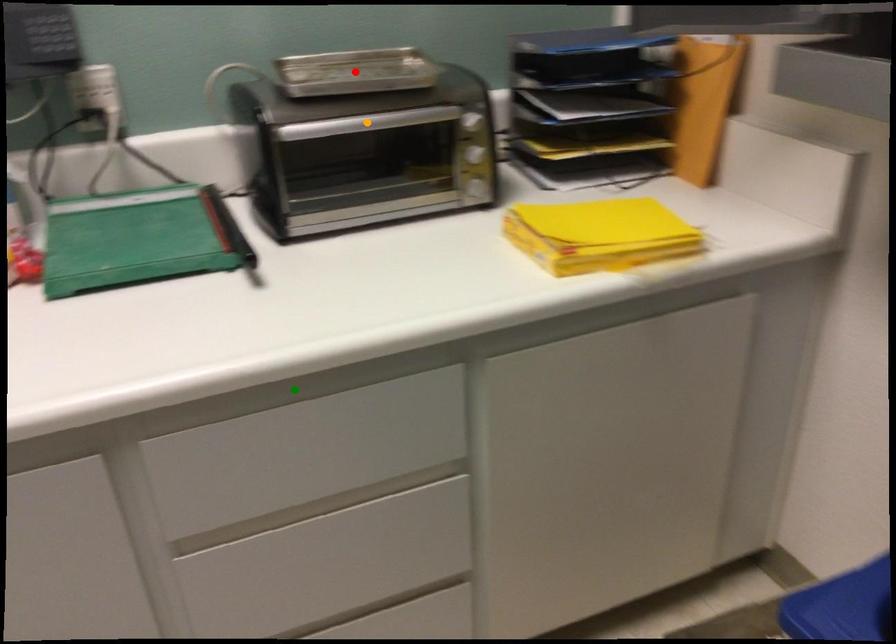
Order these from nearest to farthest:
green point | red point | orange point

green point → orange point → red point